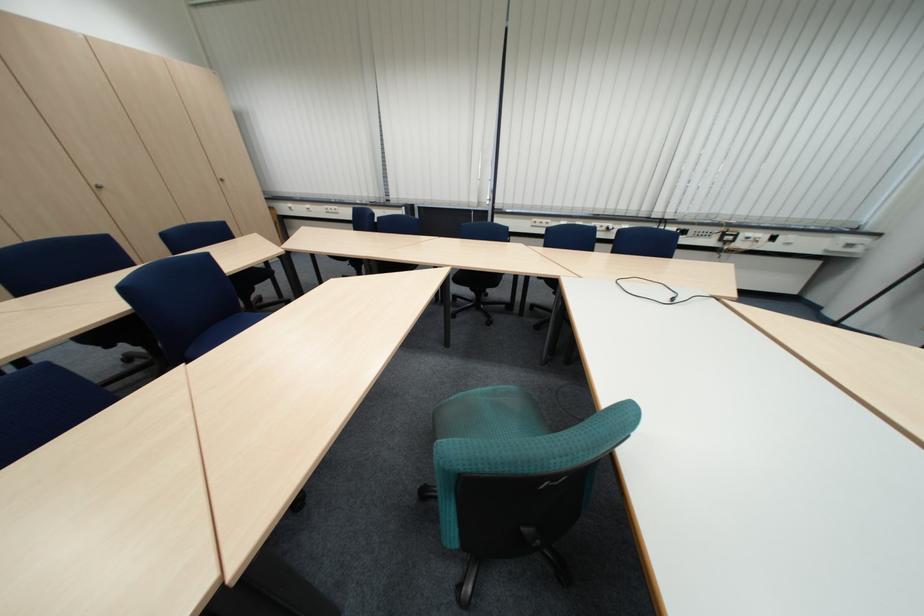
This screenshot has height=616, width=924. Find the location of `teal chair sitting surface`. teal chair sitting surface is located at coordinates (489, 415).